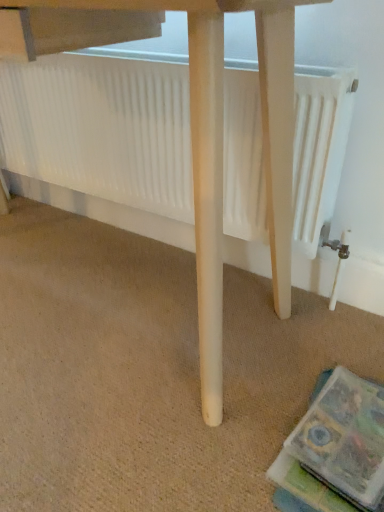
Measure the distance between point [280,495] and camera.

Point [280,495] is 69.40 centimeters from camera.

The width and height of the screenshot is (384, 512). In order to click on clear plastic case at lower right in this screenshot , I will do `click(291, 502)`.

The image size is (384, 512). Describe the element at coordinates (291, 502) in the screenshot. I see `clear plastic case at lower right` at that location.

The height and width of the screenshot is (512, 384). I want to click on clear plastic case at lower right, so click(291, 502).